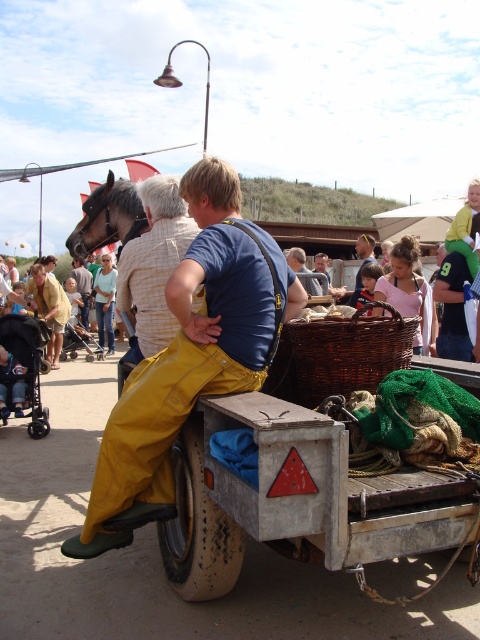
Does dark brown glossy horse at left lie behind yellow cotton pants at center?

No, it is in front of yellow cotton pants at center.

Between point (90, 236) and point (85, 320), which one is positioned in front?

Positioned in front is point (90, 236).

At what (x,y) coordinates should I click in order to perform the action: click on dark brown glossy horse at left. Please return your answer as a coordinate pair (x, y). This screenshot has height=640, width=480. Looking at the image, I should click on (108, 218).

Which is above, yellow cotton pants at center or blue denim shirt at center?

blue denim shirt at center

In the scene shown: Is yellow cotton pants at center positioned before blue denim shirt at center?

No, it is behind blue denim shirt at center.

Is point (74, 266) closer to camera compared to point (368, 252)?

No, it is behind (368, 252).

You are a GUI agent. You are given a task and a screenshot of the screen. Output one action in this format:
    pyautogui.click(x=<x>, y=<y>)
    Task: Click on the yellow cotton pants at center
    This screenshot has width=480, height=640.
    Given the screenshot: What is the action you would take?
    pyautogui.click(x=83, y=288)

Is yellow canvas overalls at center bigger than blue denim shirt at center?

Indeed, yellow canvas overalls at center has a larger size compared to blue denim shirt at center.

Is yellow canvas overalls at center shorter than blue denim shirt at center?

In fact, yellow canvas overalls at center may be taller than blue denim shirt at center.

Who is more distant from viewer, (x=171, y=442) or (x=357, y=282)?

The point (x=357, y=282) is more distant.

You are a GUI agent. You are given a task and a screenshot of the screen. Output one action in this format:
    pyautogui.click(x=<x>, y=<y>)
    Task: Click on the yellow canvas overalls at center
    This screenshot has width=480, height=640.
    Given the screenshot: What is the action you would take?
    pyautogui.click(x=191, y=355)